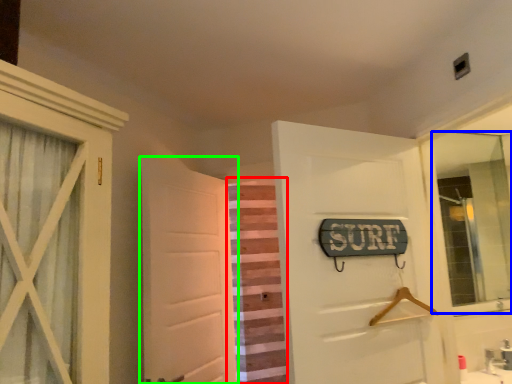
Question: Estimate the real-world distances between objects in this image. Which object is closer to curtain (highlighted by a red box), mirror (highlighted by a blue box) or door (highlighted by a green box)?

Choices:
 (A) mirror
 (B) door

Answer: (B)